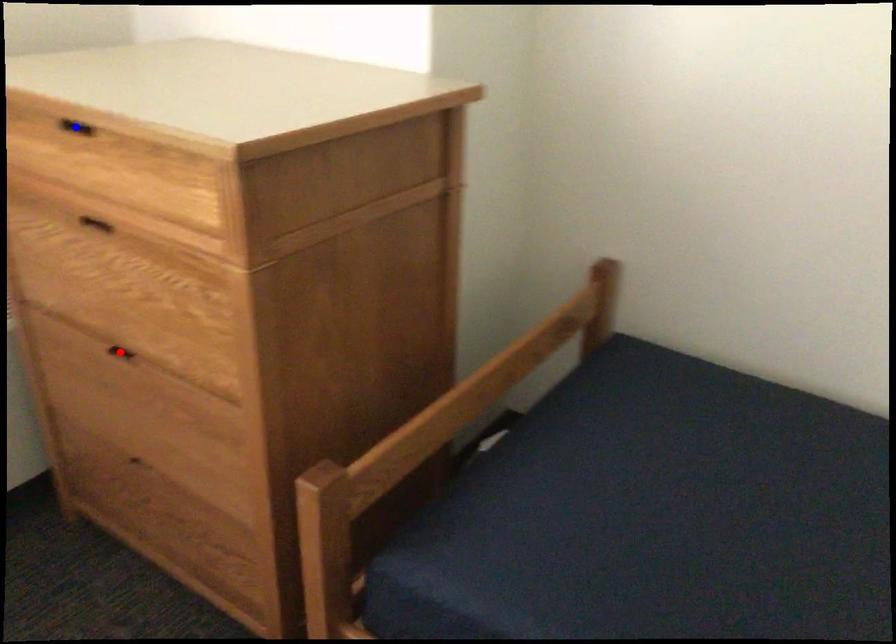
Question: Which of the two points in the image is closer to the camera?

Choices:
 (A) Blue point is closer.
 (B) Red point is closer.

Answer: (A)